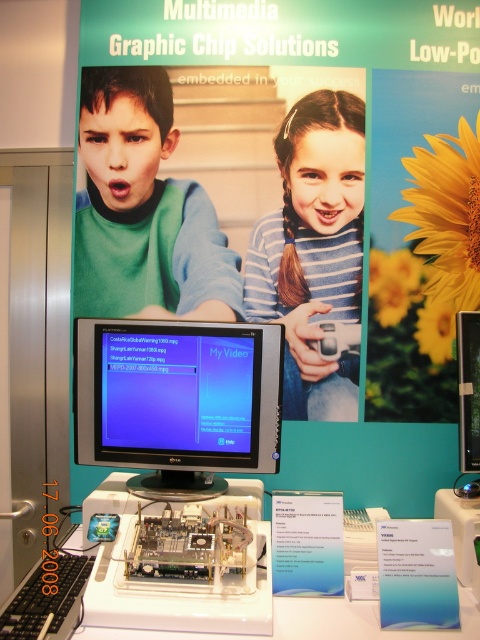
Question: Which object appears farthest from the camera in this image?

Choices:
 (A) satin black monitor at center
 (B) white plastic table at center
 (C) blue striped shirt at center

Answer: (C)

Question: Which point is farther to the camera?

Choices:
 (A) (148, 260)
 (B) (302, 636)

Answer: (A)

Question: Can you confirm if green matte shirt at upper left is thinner than blue striped shirt at center?

Choices:
 (A) no
 (B) yes

Answer: (A)

Question: Based on their relative distances, which object is nearer to the blue striped shirt at center?

Choices:
 (A) white plastic table at center
 (B) green matte shirt at upper left

Answer: (B)

Question: From the image, what is the correct spatial relationship of satin black monitor at center in relation to green matte shirt at upper left?

Choices:
 (A) below
 (B) above

Answer: (A)

Question: Does satin black monitor at center have a larger size compared to green matte shirt at upper left?

Choices:
 (A) no
 (B) yes

Answer: (B)